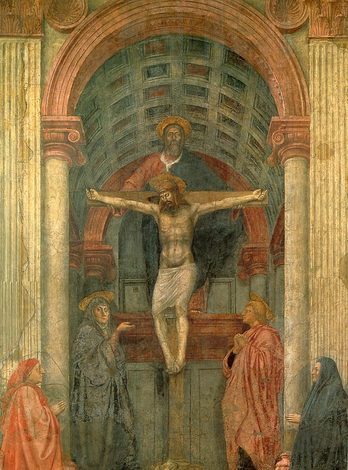
You are a GUI agent. You are given a task and a screenshot of the screen. Output one action in this format:
    pyautogui.click(x=<x>, y=<y>)
    Task: Click on the archway
    
    Given the screenshot: What is the action you would take?
    pyautogui.click(x=187, y=22)